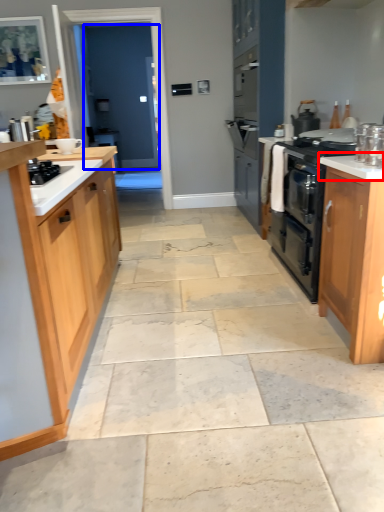
Question: Among these objects, which one is farthest to the camera, countertop (highlighted by a red box) or glass door (highlighted by a blue box)?

Choices:
 (A) countertop
 (B) glass door

Answer: (B)